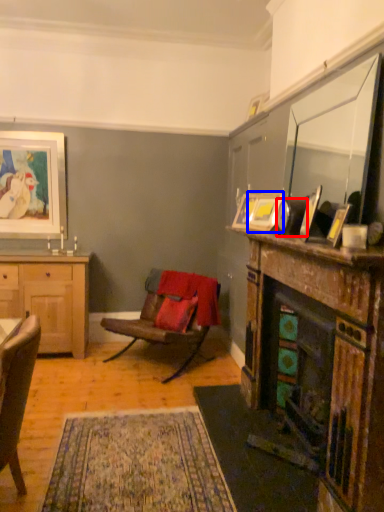
Question: Among these objects, which one is farthest to the camera, corded phone (highlighted by a red box) or picture frame (highlighted by a blue box)?

Choices:
 (A) corded phone
 (B) picture frame

Answer: (B)